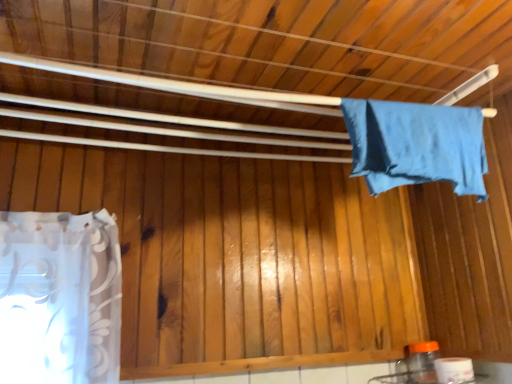
Question: Can you confirm if blue fabric at upper right is positioned to the left of white glossy toilet paper at lower right?

Choices:
 (A) yes
 (B) no

Answer: (A)

Question: Is blue fabric at upper right touching white glossy toilet paper at lower right?

Choices:
 (A) yes
 (B) no

Answer: (B)

Question: Does blue fabric at upper right lie behind white glossy toilet paper at lower right?

Choices:
 (A) no
 (B) yes

Answer: (A)

Question: From the image's perspective, is blue fabric at upper right under white glossy toilet paper at lower right?

Choices:
 (A) yes
 (B) no

Answer: (B)

Question: Is blue fabric at upper right to the right of white glossy toilet paper at lower right from the viewer's perspective?

Choices:
 (A) yes
 (B) no

Answer: (B)

Question: Does blue fabric at upper right have a lesser width compared to white glossy toilet paper at lower right?

Choices:
 (A) yes
 (B) no

Answer: (B)

Question: Considering the relative positions of white glossy toilet paper at lower right and blue fabric at upper right in the image provided, is white glossy toilet paper at lower right to the right of blue fabric at upper right from the viewer's perspective?

Choices:
 (A) yes
 (B) no

Answer: (A)

Question: Is white glossy toilet paper at lower right outside of blue fabric at upper right?

Choices:
 (A) yes
 (B) no

Answer: (A)

Question: Is the surface of white glossy toilet paper at lower right in direct contact with blue fabric at upper right?

Choices:
 (A) no
 (B) yes

Answer: (A)

Question: Considering the relative sizes of white glossy toilet paper at lower right and blue fabric at upper right in the image provided, is white glossy toilet paper at lower right taller than blue fabric at upper right?

Choices:
 (A) yes
 (B) no

Answer: (B)

Question: Is white glossy toilet paper at lower right facing towards blue fabric at upper right?

Choices:
 (A) no
 (B) yes

Answer: (A)

Question: Does white glossy toilet paper at lower right have a lesser width compared to blue fabric at upper right?

Choices:
 (A) yes
 (B) no

Answer: (A)

Question: Does point (408, 173) appear closer or farther from the camera than point (461, 382)?

Choices:
 (A) closer
 (B) farther

Answer: (A)